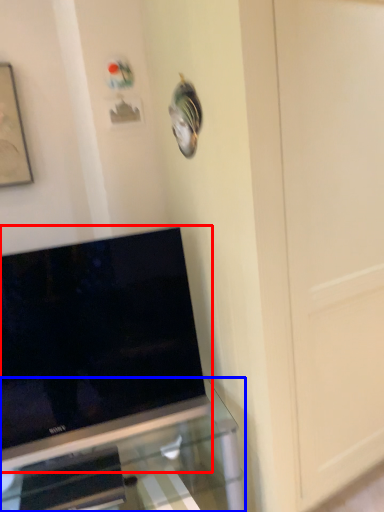
Question: Which object appears closest to the camera in this image, television (highlighted by a red box) or furniture (highlighted by a blue box)?

Choices:
 (A) television
 (B) furniture

Answer: (B)